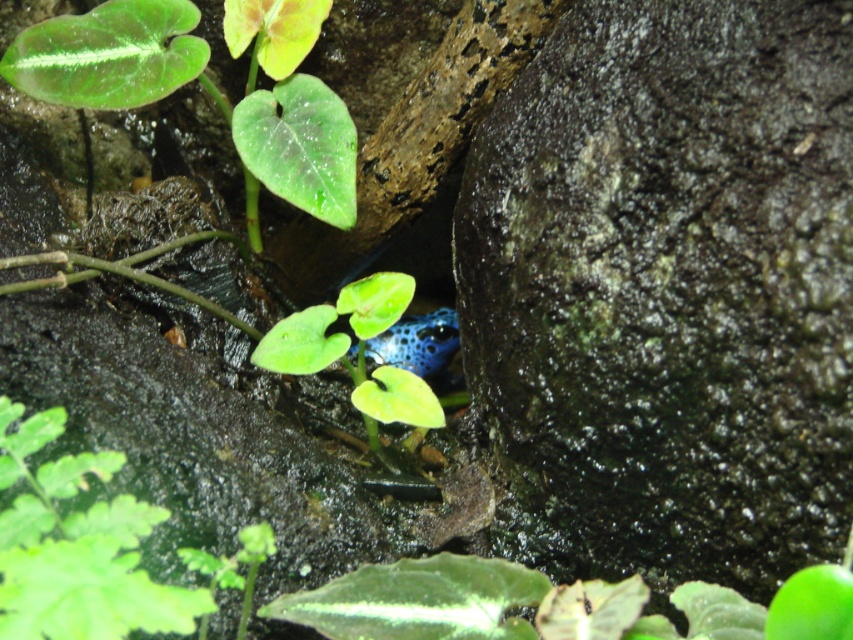
You are an entomologist examining the scene. You need to collect samples from the green glossy leaf at upper left and the green matte leaf at center. Which leaf should you reach for first to collect the closer one?

The green glossy leaf at upper left is closer to you, so you should reach for the green glossy leaf at upper left first.